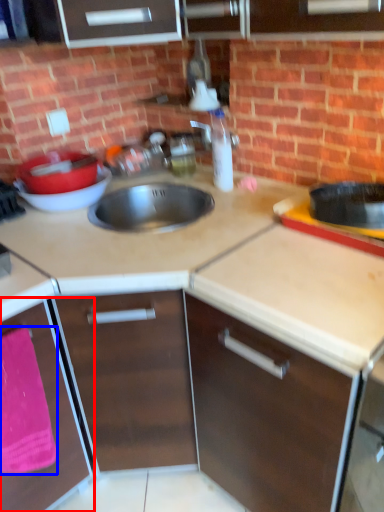
Question: Which object is closer to the camera taking this photo, cabinetry (highlighted by a red box) or blanket (highlighted by a blue box)?

Choices:
 (A) cabinetry
 (B) blanket

Answer: (A)